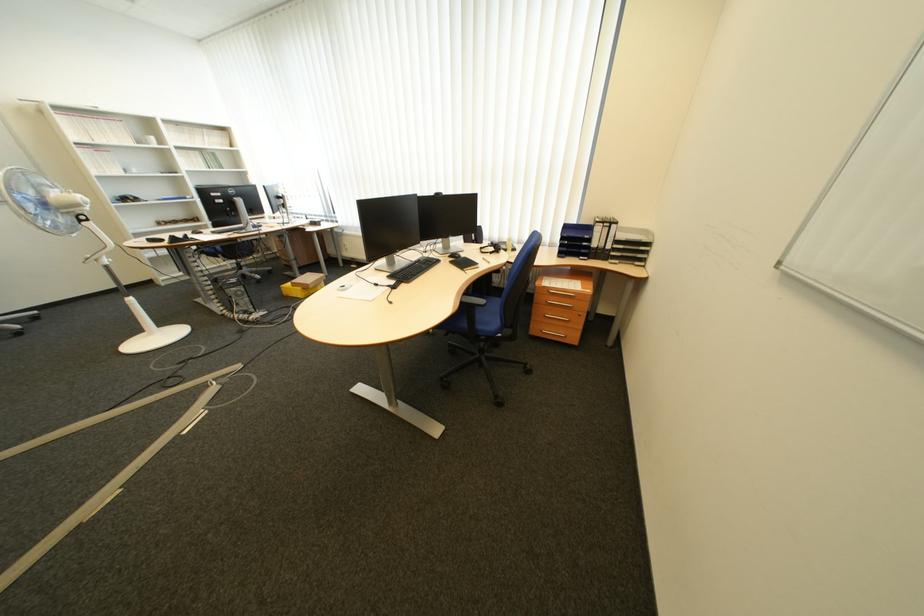
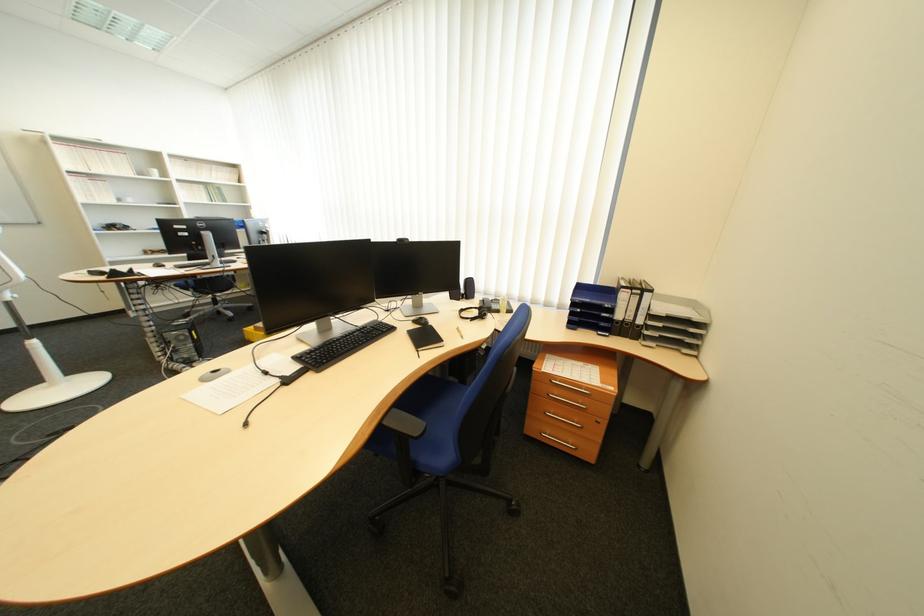
What movement of the cameraman would produce the second image?

The cameraman moved toward right, forward.